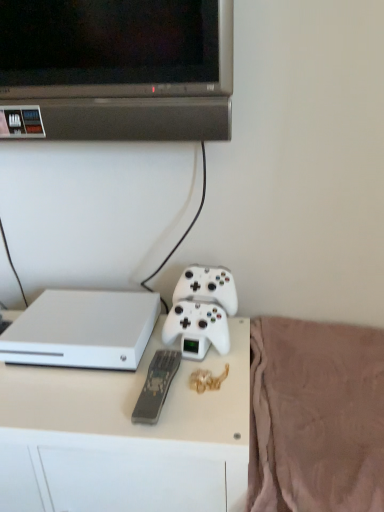
The width and height of the screenshot is (384, 512). I want to click on free space in front of white matte gaming console at lower left, so click(77, 400).